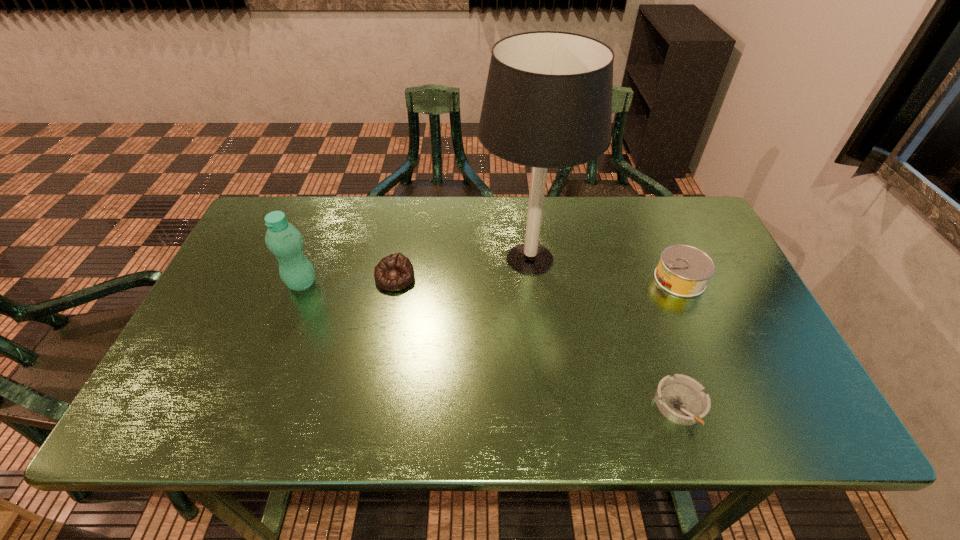
I want to click on the tallest object, so click(548, 100).

At what (x,y) coordinates should I click in order to perform the action: click on table lamp. Please return your answer as a coordinate pair (x, y). Looking at the image, I should click on (548, 100).

Locate an element on the screen. the leftmost object is located at coordinates (286, 242).

I want to click on bottle, so click(x=286, y=242).

Image resolution: width=960 pixels, height=540 pixels. Identify the location of can. (683, 270).

Find the location of `the second object from left to right`. the second object from left to right is located at coordinates (395, 272).

Where is `beanbag`? This screenshot has height=540, width=960. beanbag is located at coordinates (395, 272).

This screenshot has width=960, height=540. I want to click on the nearest object, so click(681, 399).

You are a GUI agent. You are given a task and a screenshot of the screen. Output one action in this format:
    pyautogui.click(x=<x>, y=<y>)
    Task: Click on the shortest object
    
    Given the screenshot: What is the action you would take?
    pyautogui.click(x=681, y=399)

Locate an element on the screen. vacant space located 0.210m on the front of the table lamp is located at coordinates (542, 366).